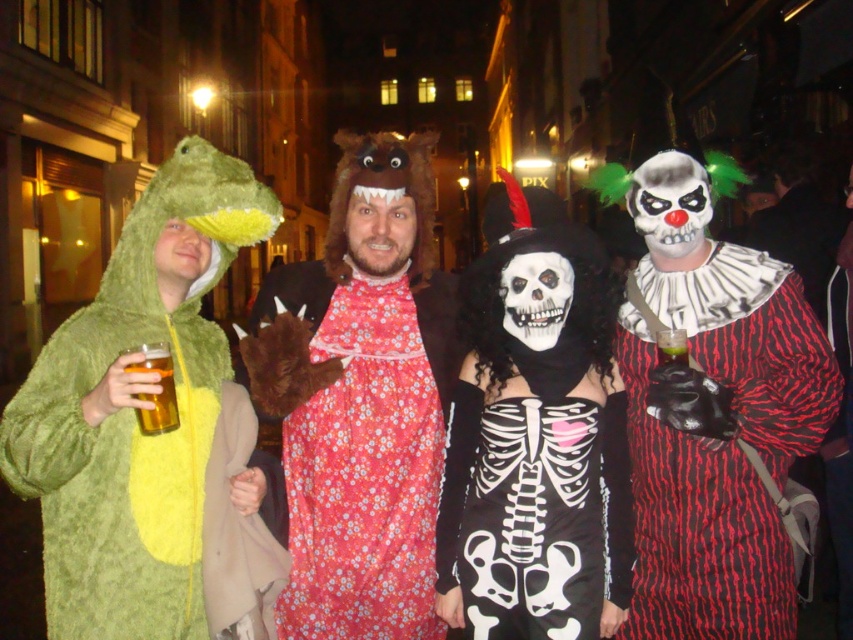
You are a photographer positioned at the center of the scene. You want to take a photo that includes both the red striped clown at right and the translucent yellow liquid at lower left. Which object will appear larger in the photo?

The red striped clown at right will appear larger in the photo because it is closer to the photographer than the translucent yellow liquid at lower left.

Consider the image. You are a photographer trying to capture the entire group in a single photo. The camera you are using has a rectangular frame. Given that the red striped clown at right is positioned at point 0.819, 0.818 on the image grid, will the clown be inside the frame if the frame covers from 0.7 to 1.0 on both the x and y axes?

The red striped clown at right is positioned at point [697,524], which falls within the frame covering 0.7 to 1.0 on both axes. Therefore, the clown will be inside the frame.